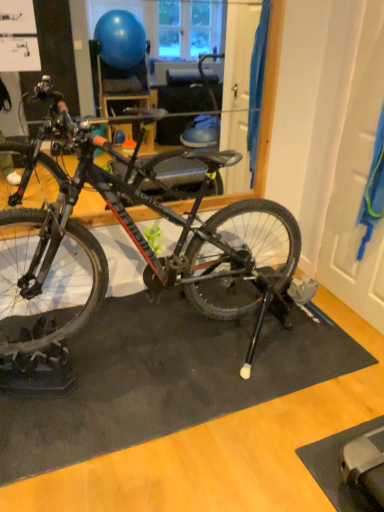
Identify the location of vacant space underneath black matte bicycle at center (from a real-world perspective). This screenshot has height=512, width=384. (130, 353).